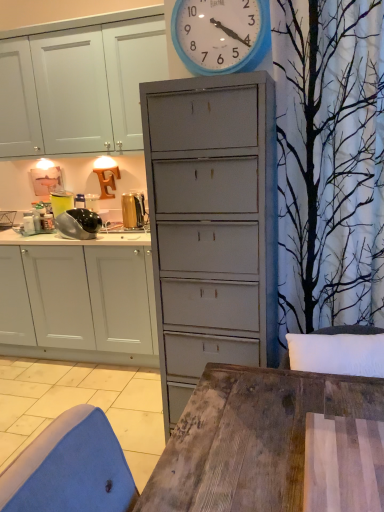
Question: From a real-world perspective, is blue plastic wall clock at upper center beneath shiny metallic food processor at left, which appears as the second appliance when viewed from the right?

Choices:
 (A) yes
 (B) no

Answer: (B)

Question: Considering the relative sizes of blue plastic wall clock at upper center and shiny metallic food processor at left, which appears as the second appliance when viewed from the right, in the image provided, is blue plastic wall clock at upper center thinner than shiny metallic food processor at left, which appears as the second appliance when viewed from the right,?

Choices:
 (A) yes
 (B) no

Answer: (A)

Question: Would you say blue plastic wall clock at upper center is outside shiny metallic food processor at left, the first appliance when ordered from left to right?

Choices:
 (A) yes
 (B) no

Answer: (A)

Question: Does blue plastic wall clock at upper center contain shiny metallic food processor at left, which appears as the second appliance when viewed from the right?

Choices:
 (A) no
 (B) yes

Answer: (A)

Question: Could you tell me if blue plastic wall clock at upper center is facing shiny metallic food processor at left, the first appliance when ordered from left to right?

Choices:
 (A) no
 (B) yes

Answer: (A)

Question: Is shiny metallic food processor at left, the first appliance when ordered from left to right, inside or outside of gold metallic toaster at upper left, which is counted as the first appliance, starting from the right?

Choices:
 (A) outside
 (B) inside

Answer: (A)

Question: Considering their positions, is shiny metallic food processor at left, which appears as the second appliance when viewed from the right, located in front of or behind gold metallic toaster at upper left, which is counted as the first appliance, starting from the right?

Choices:
 (A) front
 (B) behind

Answer: (A)

Question: Considering the positions of point (71, 224) and point (140, 224), is point (71, 224) closer or farther from the camera than point (140, 224)?

Choices:
 (A) farther
 (B) closer

Answer: (B)

Question: Based on their positions, is shiny metallic food processor at left, which appears as the second appliance when viewed from the right, located to the left or right of gold metallic toaster at upper left, acting as the 2th appliance starting from the left?

Choices:
 (A) right
 (B) left

Answer: (B)

Question: Considering the positions of gold metallic toaster at upper left, which is counted as the first appliance, starting from the right, and white matte cabinet at left in the image, is gold metallic toaster at upper left, which is counted as the first appliance, starting from the right, wider or thinner than white matte cabinet at left?

Choices:
 (A) wide
 (B) thin

Answer: (B)

Question: Is point (122, 206) closer or farther from the camera than point (130, 315)?

Choices:
 (A) farther
 (B) closer

Answer: (A)

Question: From a real-world perspective, is gold metallic toaster at upper left, which is counted as the first appliance, starting from the right, physically located above or below white matte cabinet at left?

Choices:
 (A) below
 (B) above

Answer: (B)

Question: Considering their positions, is gold metallic toaster at upper left, which is counted as the first appliance, starting from the right, located in front of or behind white matte cabinet at left?

Choices:
 (A) front
 (B) behind

Answer: (B)

Question: From the image's perspective, is white matte cabinet at left positioned above or below blue plastic wall clock at upper center?

Choices:
 (A) below
 (B) above

Answer: (A)

Question: In terms of height, does white matte cabinet at left look taller or shorter compared to blue plastic wall clock at upper center?

Choices:
 (A) tall
 (B) short

Answer: (A)